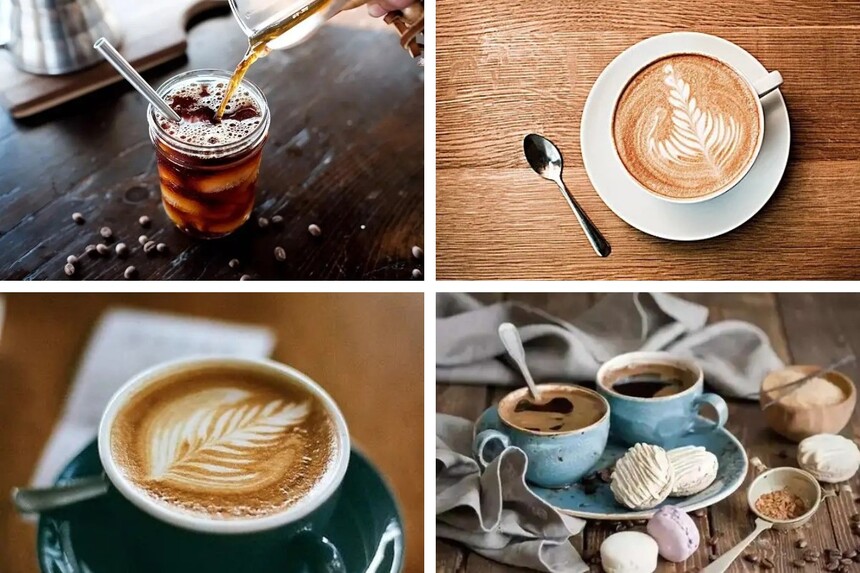
This screenshot has width=860, height=573. Identify the location of cups. (635, 416), (566, 445), (332, 480), (225, 193), (646, 184).